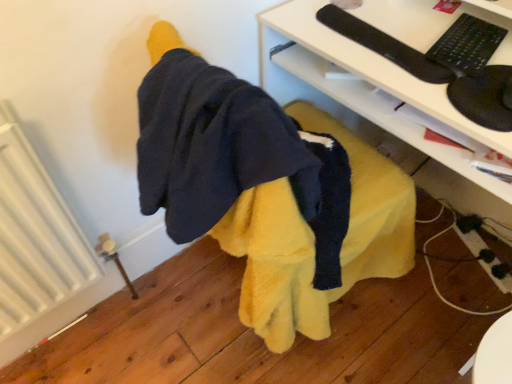
In the scene shown: Measure the distance between point (73, 234) and camera.

1.10 meters.

What is the approximate height of white glossy desk at center?

30.67 inches.

The height and width of the screenshot is (384, 512). What do you see at coordinates (466, 46) in the screenshot? I see `black matte keyboard at upper right` at bounding box center [466, 46].

I want to click on white ribbed radiator at left, so click(x=35, y=236).

Choose the correct answer: Is black matte keyboard at upper right inside white ribbed radiator at left or outside it?

The correct answer is: outside.

Would you consider black matte keyboard at upper right to be distant from white ribbed radiator at left?

Absolutely, black matte keyboard at upper right is distant from white ribbed radiator at left.

Can you tell me how much black matte keyboard at upper right and white ribbed radiator at left differ in facing direction?

74.8 degrees.

Can you confirm if black matte keyboard at upper right is smaller than white glossy desk at center?

Correct, black matte keyboard at upper right occupies less space than white glossy desk at center.

Between point (461, 24) and point (386, 18), which one is positioned in front?

The point (461, 24) is closer to the camera.

Considering the sizes of black matte keyboard at upper right and white glossy desk at center in the image, is black matte keyboard at upper right wider or thinner than white glossy desk at center?

Clearly, black matte keyboard at upper right has less width compared to white glossy desk at center.

Considering their positions, is black matte keyboard at upper right located in front of or behind white glossy desk at center?

Clearly, black matte keyboard at upper right is behind white glossy desk at center.

Is white ribbed radiator at left taller or shorter than white glossy desk at center?

Clearly, white ribbed radiator at left is shorter compared to white glossy desk at center.

Is there a large distance between white ribbed radiator at left and white glossy desk at center?

That's not correct — white ribbed radiator at left is a little close to white glossy desk at center.

Who is bigger, white ribbed radiator at left or white glossy desk at center?

white glossy desk at center is bigger.

Is white ribbed radiator at left further to camera compared to white glossy desk at center?

No, white ribbed radiator at left is closer to the viewer.

Considering the relative sizes of white glossy desk at center and black matte keyboard at upper right in the image provided, is white glossy desk at center smaller than black matte keyboard at upper right?

No, white glossy desk at center is not smaller than black matte keyboard at upper right.

Which object is closer to the camera taking this photo, white glossy desk at center or black matte keyboard at upper right?

white glossy desk at center is closer to the camera.

From the image's perspective, is white glossy desk at center above or below black matte keyboard at upper right?

From the image's perspective, white glossy desk at center appears below black matte keyboard at upper right.

Is white glossy desk at center looking in the opposite direction of black matte keyboard at upper right?

That's not correct — white glossy desk at center is not looking away from black matte keyboard at upper right.

Is white ribbed radiator at left completely or partially inside white glossy desk at center?

No.

Considering the relative sizes of white glossy desk at center and white ribbed radiator at left in the image provided, is white glossy desk at center thinner than white ribbed radiator at left?

Incorrect, the width of white glossy desk at center is not less than that of white ribbed radiator at left.

Is white glossy desk at center aimed at white ribbed radiator at left?

Yes, white glossy desk at center is aimed at white ribbed radiator at left.

Are white glossy desk at center and white ribbed radiator at left beside each other?

white glossy desk at center and white ribbed radiator at left are clearly separated.

Is the depth of white ribbed radiator at left less than that of black matte keyboard at upper right?

Yes, it is.

Is white ribbed radiator at left spatially inside black matte keyboard at upper right, or outside of it?

white ribbed radiator at left is not enclosed by black matte keyboard at upper right.

Is white ribbed radiator at left oriented away from black matte keyboard at upper right?

That's not correct — white ribbed radiator at left is not looking away from black matte keyboard at upper right.

Considering the relative sizes of white ribbed radiator at left and black matte keyboard at upper right in the image provided, is white ribbed radiator at left wider than black matte keyboard at upper right?

No, white ribbed radiator at left is not wider than black matte keyboard at upper right.

The width and height of the screenshot is (512, 384). Identify the location of radiator in front of the black matte keyboard at upper right. (35, 236).

Where is `keyboard to the left of white glossy desk at center`? The image size is (512, 384). keyboard to the left of white glossy desk at center is located at coordinates (466, 46).

Looking at the image, which one is located further to black matte keyboard at upper right, white ribbed radiator at left or white glossy desk at center?

Among the two, white ribbed radiator at left is located further to black matte keyboard at upper right.

When comparing their distances from white ribbed radiator at left, does white glossy desk at center or black matte keyboard at upper right seem closer?

white glossy desk at center lies closer to white ribbed radiator at left than the other object.

Estimate the real-world distances between objects in this image. Which object is closer to white glossy desk at center, white ribbed radiator at left or black matte keyboard at upper right?

The object closer to white glossy desk at center is black matte keyboard at upper right.

From the image, which object appears to be nearer to white ribbed radiator at left, black matte keyboard at upper right or white glossy desk at center?

white glossy desk at center.

Estimate the real-world distances between objects in this image. Which object is further from black matte keyboard at upper right, white glossy desk at center or white ribbed radiator at left?

white ribbed radiator at left.

Considering their positions, is black matte keyboard at upper right positioned further to white glossy desk at center than white ribbed radiator at left?

white ribbed radiator at left lies further to white glossy desk at center than the other object.

Where is `keyboard between white ribbed radiator at left and white glossy desk at center from left to right`? The height and width of the screenshot is (384, 512). keyboard between white ribbed radiator at left and white glossy desk at center from left to right is located at coordinates (466, 46).